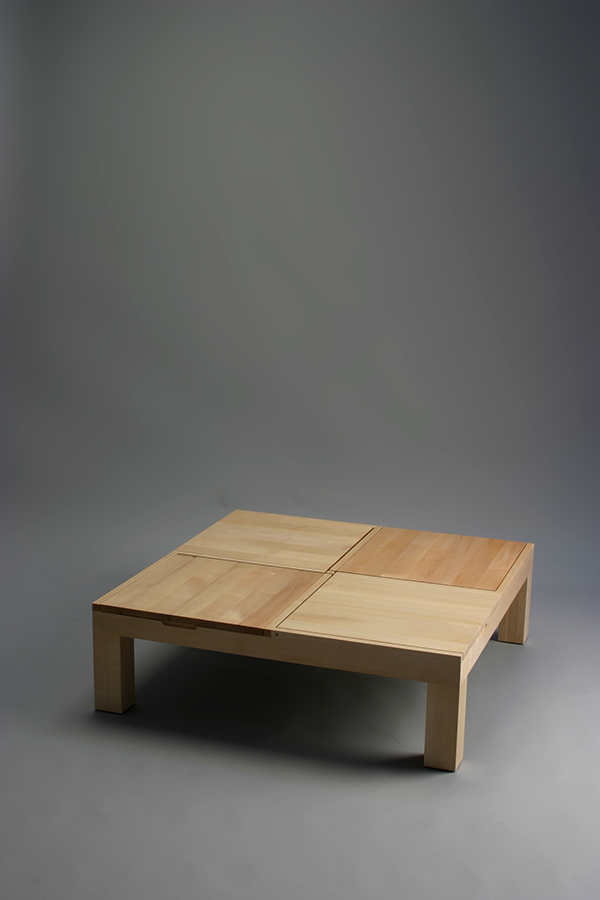
Image resolution: width=600 pixels, height=900 pixels. I want to click on right bottom corner of table, so click(397, 608).